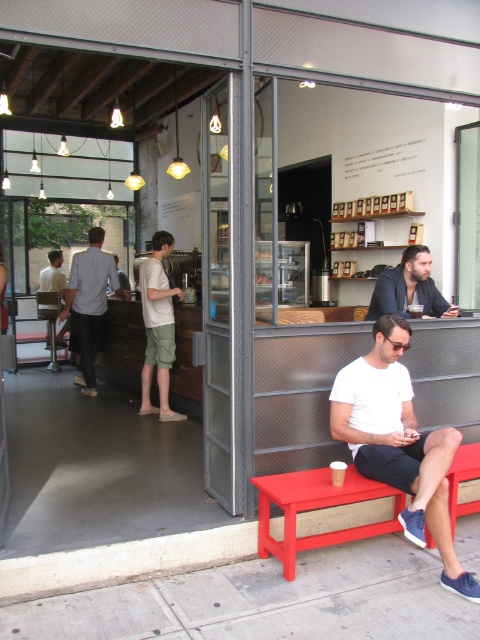
From the picture: Which is below, white matte shirt at center or matte red bench at lower center?

Positioned lower is matte red bench at lower center.

This screenshot has width=480, height=640. Describe the element at coordinates (398, 444) in the screenshot. I see `white matte shirt at center` at that location.

Measure the distance between point (385, 328) and camera.

Point (385, 328) and camera are 3.48 meters apart.

What are the coordinates of `white matte shirt at center` in the screenshot? It's located at (398, 444).

How much distance is there between light green cotton shorts at center and dark blue jacket at center?

A distance of 7.09 feet exists between light green cotton shorts at center and dark blue jacket at center.

Measure the distance between light green cotton shorts at center and camera.

light green cotton shorts at center is 5.32 meters from camera.

Locate an element on the screen. This screenshot has height=640, width=480. light green cotton shorts at center is located at coordinates (157, 326).

Measure the distance between white matte shirt at center and dark blue jacket at center.

white matte shirt at center and dark blue jacket at center are 3.30 feet apart from each other.

The width and height of the screenshot is (480, 640). What do you see at coordinates (398, 444) in the screenshot? I see `white matte shirt at center` at bounding box center [398, 444].

Which is in front, point (345, 440) or point (374, 301)?

Point (345, 440)

The width and height of the screenshot is (480, 640). What are the coordinates of `white matte shirt at center` in the screenshot? It's located at (398, 444).